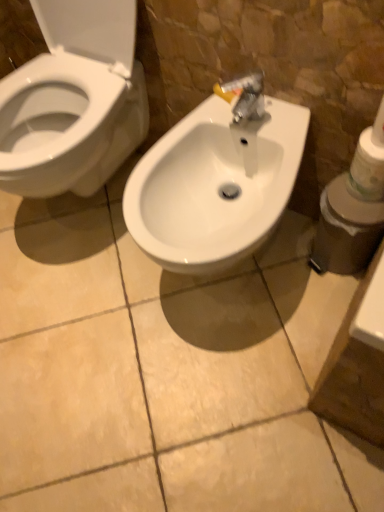
Identify the location of white plastic container at right. This screenshot has width=384, height=512. (346, 230).

Where is `white matte toilet paper at right`? This screenshot has height=512, width=384. white matte toilet paper at right is located at coordinates (367, 169).

Are white glossy sink at center and white matte toilet paper at right beside each other?

No, white glossy sink at center is not making contact with white matte toilet paper at right.

Which object is positioned more to the right, white glossy sink at center or white matte toilet paper at right?

white matte toilet paper at right is more to the right.

Considering the positions of objects white glossy sink at center and white matte toilet paper at right in the image provided, who is behind, white glossy sink at center or white matte toilet paper at right?

white matte toilet paper at right is further from the camera.

Could you tell me if white glossy sink at center is facing white matte toilet paper at right?

No, white glossy sink at center is not turned towards white matte toilet paper at right.

Is white matte toilet paper at right turned away from white glossy sink at center?

No, white matte toilet paper at right's orientation is not away from white glossy sink at center.

Considering the relative sizes of white matte toilet paper at right and white glossy sink at center in the image provided, is white matte toilet paper at right wider than white glossy sink at center?

In fact, white matte toilet paper at right might be narrower than white glossy sink at center.

Is white glossy sink at center completely or partially inside white matte toilet paper at right?

Actually, white glossy sink at center is outside white matte toilet paper at right.

Who is more distant, white glossy sink at center or white plastic container at right?

white plastic container at right.

From a real-world perspective, is white glossy sink at center on white plastic container at right?

Yes.

In the scene shown: Can you confirm if white glossy sink at center is taller than white plastic container at right?

Indeed, white glossy sink at center has a greater height compared to white plastic container at right.

Can you confirm if white plastic container at right is wider than white glossy sink at center?

In fact, white plastic container at right might be narrower than white glossy sink at center.

Is white plastic container at right in contact with white glossy sink at center?

There is a gap between white plastic container at right and white glossy sink at center.

Considering the positions of objects white plastic container at right and white glossy sink at center in the image provided, who is more to the left, white plastic container at right or white glossy sink at center?

Positioned to the left is white glossy sink at center.

Is white plastic container at right looking in the opposite direction of white glossy sink at center?

white plastic container at right does not have its back to white glossy sink at center.

Identify the location of toilet paper on the right of white plastic container at right. (367, 169).

Is white plastic container at right turned away from white matte toilet paper at right?

No, white plastic container at right is not facing the opposite direction of white matte toilet paper at right.

Is white matte toilet paper at right not within white plastic container at right?

Yes, white matte toilet paper at right is outside of white plastic container at right.

In the image, is white matte toilet paper at right positioned in front of or behind white plastic container at right?

In the image, white matte toilet paper at right appears in front of white plastic container at right.

Is white matte toilet paper at right oriented away from white plastic container at right?

white matte toilet paper at right is not turned away from white plastic container at right.

Where is `sink located on the left of white matte toilet paper at right`? sink located on the left of white matte toilet paper at right is located at coordinates (217, 180).

In order to click on sink that appears below the white matte toilet paper at right (from the image's perspective) in this screenshot , I will do `click(217, 180)`.

Estimate the real-world distances between objects in this image. Which object is further from white glossy sink at center, white plastic container at right or white matte toilet paper at right?

white matte toilet paper at right is further to white glossy sink at center.

When comparing their distances from white matte toilet paper at right, does white glossy sink at center or white plastic container at right seem closer?

Among the two, white plastic container at right is located nearer to white matte toilet paper at right.

Which object lies nearer to the anchor point white plastic container at right, white matte toilet paper at right or white glossy sink at center?

white matte toilet paper at right.

Based on their spatial positions, is white plastic container at right or white glossy sink at center closer to white matte toilet paper at right?

white plastic container at right lies closer to white matte toilet paper at right than the other object.

From the image, which object appears to be nearer to white glossy sink at center, white matte toilet paper at right or white plastic container at right?

Based on the image, white plastic container at right appears to be nearer to white glossy sink at center.

Based on their spatial positions, is white glossy sink at center or white matte toilet paper at right further from white plastic container at right?

Among the two, white glossy sink at center is located further to white plastic container at right.

At what (x,y) coordinates should I click in order to perform the action: click on toiletries between white glossy sink at center and white matte toilet paper at right in the horizontal direction. Please return your answer as a coordinate pair (x, y). This screenshot has height=512, width=384. Looking at the image, I should click on (346, 230).